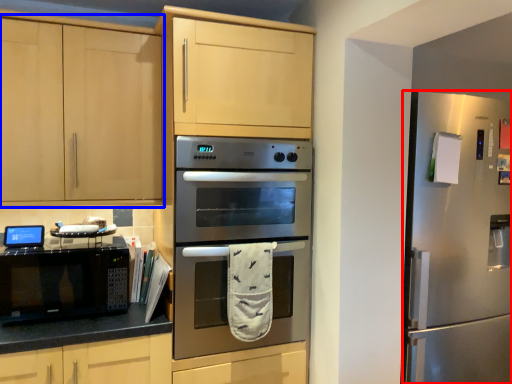
Question: Which point is closer to the camera, refrigerator (highlighted by a red box) or cabinetry (highlighted by a blue box)?

Choices:
 (A) refrigerator
 (B) cabinetry

Answer: (B)